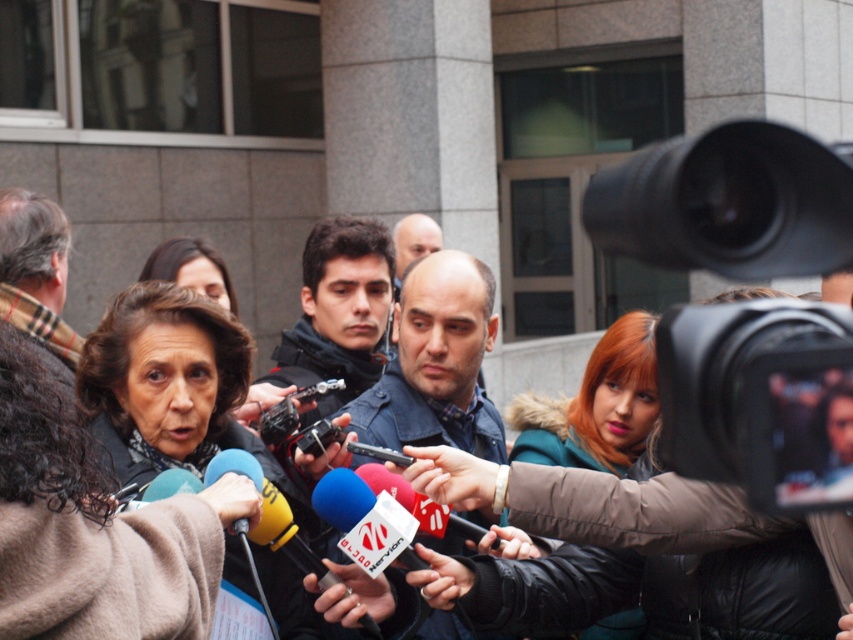
Question: Which object appears farthest from the camera in this image?

Choices:
 (A) matte black jacket at center
 (B) dark brown hair at center

Answer: (A)

Question: Which of these objects is positioned closest to the shiny teal jacket at center?

Choices:
 (A) matte brown scarf at center
 (B) matte black jacket at center

Answer: (B)

Question: Considering the relative positions of shiny teal jacket at center and smooth bald head at center in the image provided, where is shiny teal jacket at center located with respect to smooth bald head at center?

Choices:
 (A) left
 (B) right

Answer: (B)

Question: Is blue denim jacket at center wider than matte black jacket at center?

Choices:
 (A) yes
 (B) no

Answer: (A)

Question: Which point is farther to the camera?

Choices:
 (A) matte brown scarf at center
 (B) smooth bald head at center
 (C) dark blue jacket at center
 (D) blue denim jacket at center

Answer: (B)

Question: Is matte brown scarf at center above smooth bald head at center?

Choices:
 (A) no
 (B) yes

Answer: (A)